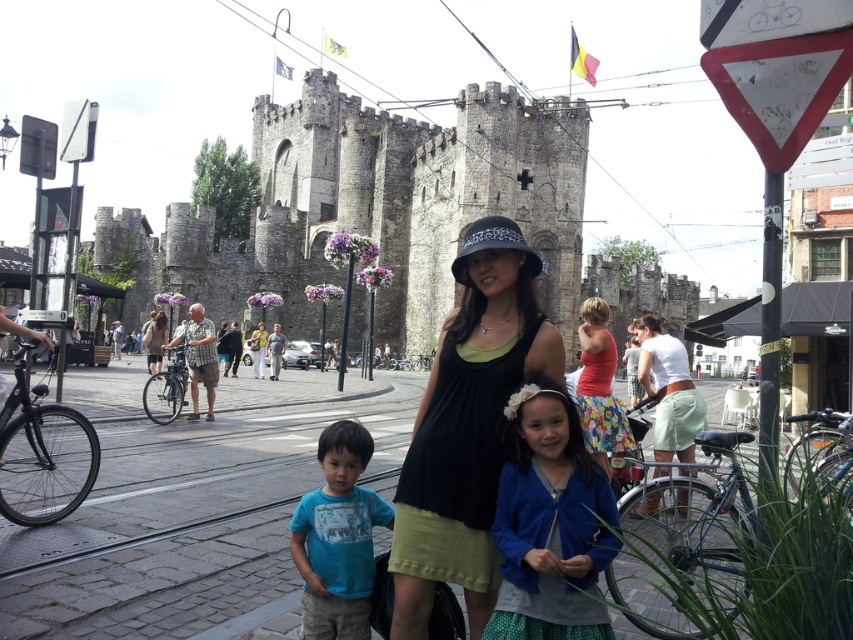
You are a photographer trying to capture the castle and the people in front of it. You want to ensure both the blue cotton cardigan at center and the blue cotton shirt at lower left are visible in your shot. Given their sizes, which one might you need to adjust your focus on to ensure clarity?

The blue cotton cardigan at center is larger in size than the blue cotton shirt at lower left, so you should focus on the blue cotton cardigan at center to ensure clarity since larger objects require more focus area.

You are a tourist standing in front of the castle. You see a blue cotton cardigan at center and a blue cotton shirt at lower left. Which one is higher up in the image?

The blue cotton cardigan at center is located above the blue cotton shirt at lower left, so the blue cotton cardigan at center is higher up in the image.